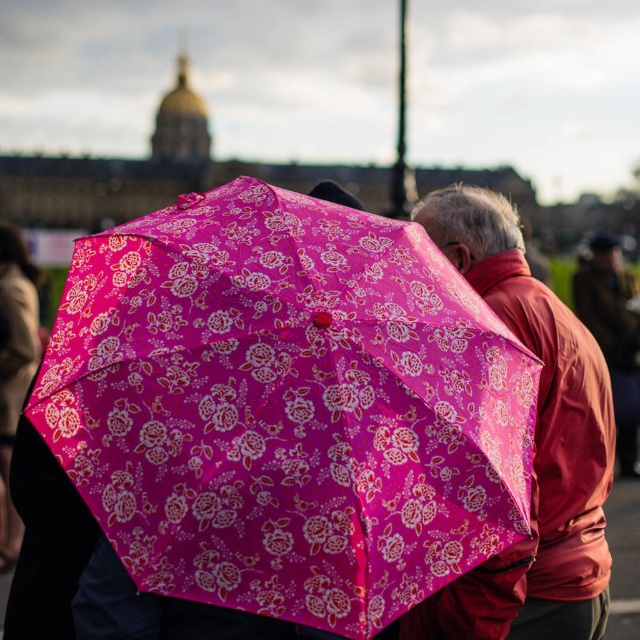
Question: Is matte pink umbrella at center wider than pink floral umbrella at upper left?

Choices:
 (A) no
 (B) yes

Answer: (B)

Question: Which object is positioned closest to the pink floral umbrella at upper left?

Choices:
 (A) pink fabric umbrella at center
 (B) matte pink umbrella at center

Answer: (B)

Question: Does matte pink umbrella at center have a greater width compared to pink floral umbrella at upper left?

Choices:
 (A) no
 (B) yes

Answer: (B)

Question: Which object is positioned closest to the pink floral umbrella at upper left?

Choices:
 (A) pink fabric umbrella at center
 (B) matte pink umbrella at center

Answer: (B)

Question: Where is matte pink umbrella at center located in relation to pink floral umbrella at upper left in the image?

Choices:
 (A) above
 (B) below

Answer: (B)

Question: Considering the real-world distances, which object is farthest from the pink fabric umbrella at center?

Choices:
 (A) pink floral umbrella at upper left
 (B) matte pink umbrella at center

Answer: (A)